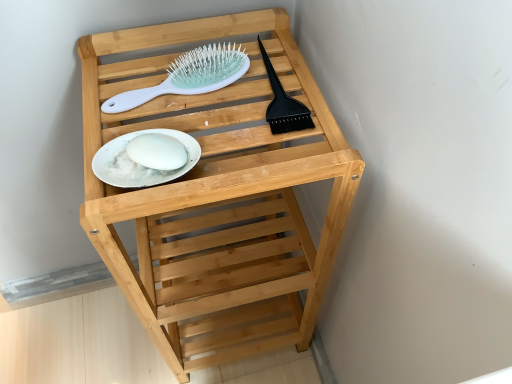
Identify the location of unoccupied area in front of white plastic hairbrush at upper center. The height and width of the screenshot is (384, 512). (151, 150).